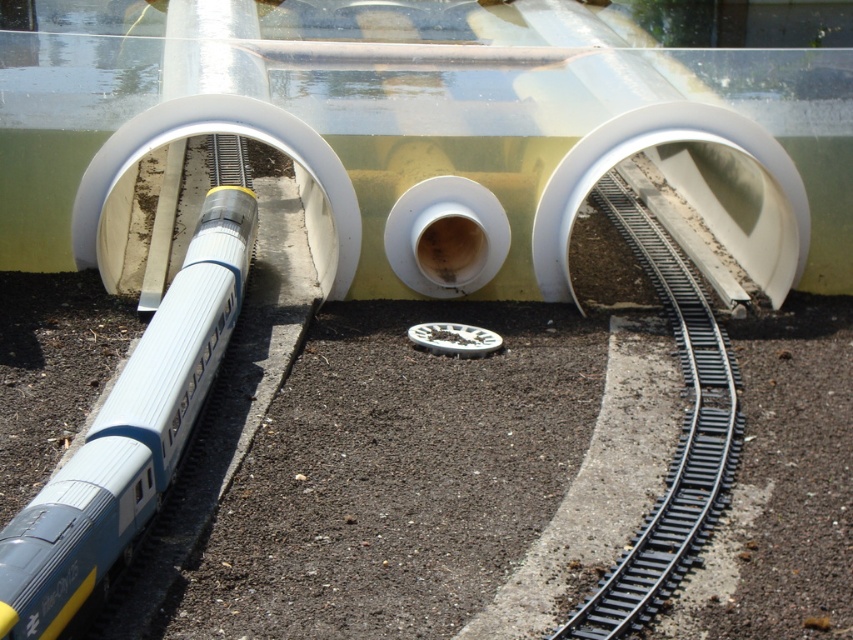
Is silver metallic train at center to the left of black metal train track at center right from the viewer's perspective?

Yes, silver metallic train at center is to the left of black metal train track at center right.

Who is more distant from viewer, (200, 381) or (605, 612)?

Point (200, 381)

I want to click on silver metallic train at center, so click(x=132, y=426).

Image resolution: width=853 pixels, height=640 pixels. Find the location of `silver metallic train at center`. silver metallic train at center is located at coordinates (132, 426).